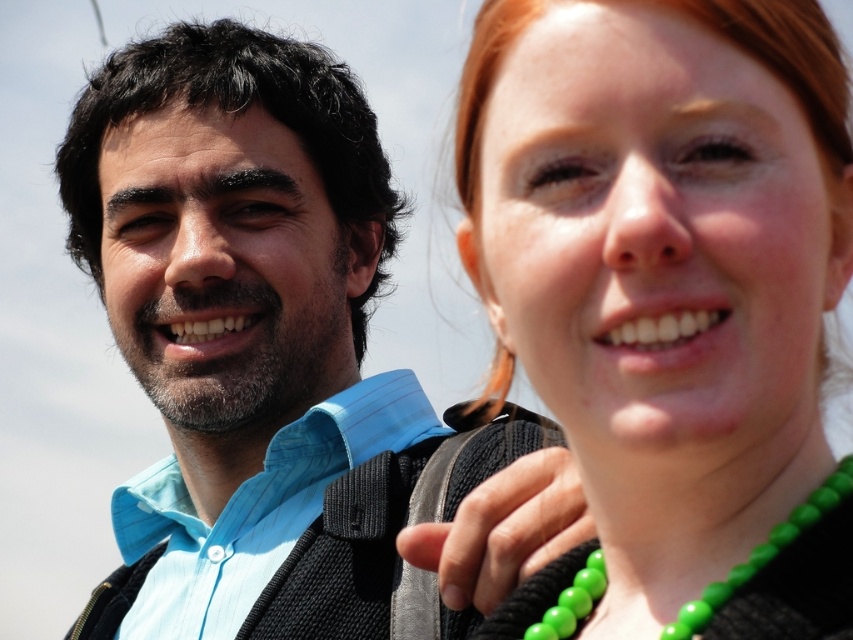
You are a photographer standing at the camera position. You want to focus on the green beaded necklace at upper right. Is the necklace within a 10 meter range of the camera?

The green beaded necklace at upper right and camera are 10.20 meters apart from each other, so the necklace is slightly beyond the 10 meter range.

In the scene shown: You are planning to take a photo of the light blue striped shirt at left and the green beads at center. Since you want to ensure both are clearly visible, which object should you focus on first to ensure proper focus?

The light blue striped shirt at left is bigger than the green beads at center, so you should focus on the light blue striped shirt at left first to ensure proper focus.

You are an artist trying to paint the scene. You need to decide which object should be placed higher in your painting. Which one is taller between the green beaded necklace at upper right and the green beads at center?

The green beaded necklace at upper right is much taller than the green beads at center, so it should be placed higher in the painting.